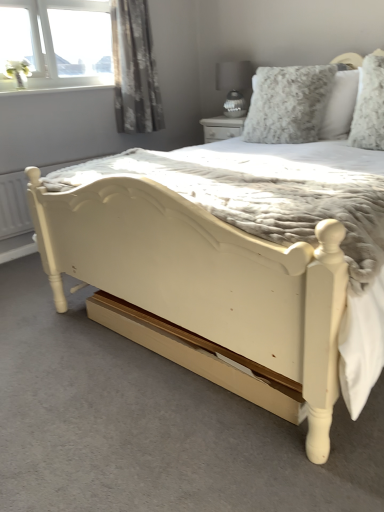
This screenshot has height=512, width=384. What do you see at coordinates (134, 69) in the screenshot?
I see `floral gray curtain at upper left` at bounding box center [134, 69].

Find the location of a particular element. This screenshot has height=512, width=384. fluffy gray pillow at upper right, which is counted as the 1th pillow, starting from the left is located at coordinates (299, 105).

Identify the location of fluffy white pillow at upper right, positioned as the first pillow in right-to-left order. (369, 106).

Where is `floral gray curtain at upper left`? This screenshot has height=512, width=384. floral gray curtain at upper left is located at coordinates (134, 69).

Between floral gray curtain at upper left and fluffy gray pillow at upper right, the second pillow from the right, which one has larger size?

With larger size is fluffy gray pillow at upper right, the second pillow from the right.

Are floral gray curtain at upper left and fluffy gray pillow at upper right, the second pillow from the right, beside each other?

There is a gap between floral gray curtain at upper left and fluffy gray pillow at upper right, the second pillow from the right.

Is floral gray curtain at upper left at the right side of fluffy gray pillow at upper right, the second pillow from the right?

Incorrect, floral gray curtain at upper left is not on the right side of fluffy gray pillow at upper right, the second pillow from the right.

Which is behind, point (244, 127) or point (147, 127)?

Positioned behind is point (147, 127).

Choose the correct answer: Is fluffy gray pillow at upper right, which is counted as the 1th pillow, starting from the left, inside floral gray curtain at upper left or outside it?

fluffy gray pillow at upper right, which is counted as the 1th pillow, starting from the left, lies outside floral gray curtain at upper left.

Considering the relative sizes of fluffy gray pillow at upper right, which is counted as the 1th pillow, starting from the left, and floral gray curtain at upper left in the image provided, is fluffy gray pillow at upper right, which is counted as the 1th pillow, starting from the left, shorter than floral gray curtain at upper left?

Indeed, fluffy gray pillow at upper right, which is counted as the 1th pillow, starting from the left, has a lesser height compared to floral gray curtain at upper left.

Which is behind, fluffy gray pillow at upper right, the second pillow from the right, or floral gray curtain at upper left?

floral gray curtain at upper left is more distant.

Is fluffy white pillow at upper right, positioned as the first pillow in right-to-left order, wider or thinner than fluffy gray pillow at upper right, the second pillow from the right?

Clearly, fluffy white pillow at upper right, positioned as the first pillow in right-to-left order, has less width compared to fluffy gray pillow at upper right, the second pillow from the right.

I want to click on pillow that appears below the fluffy gray pillow at upper right, which is counted as the 1th pillow, starting from the left (from the image's perspective), so click(x=369, y=106).

From the image's perspective, who appears lower, fluffy white pillow at upper right, positioned as the first pillow in right-to-left order, or fluffy gray pillow at upper right, the second pillow from the right?

From the image's view, fluffy white pillow at upper right, positioned as the first pillow in right-to-left order, is below.

What's the angular difference between fluffy gray pillow at upper right, the second pillow from the right, and matte gray glass lamp at upper center's facing directions?

They differ by 6.84 degrees in their facing directions.

From a real-world perspective, is fluffy gray pillow at upper right, the second pillow from the right, positioned under matte gray glass lamp at upper center based on gravity?

Yes, from a real-world perspective, fluffy gray pillow at upper right, the second pillow from the right, is under matte gray glass lamp at upper center.

Is fluffy gray pillow at upper right, which is counted as the 1th pillow, starting from the left, shorter than matte gray glass lamp at upper center?

Incorrect, the height of fluffy gray pillow at upper right, which is counted as the 1th pillow, starting from the left, does not fall short of that of matte gray glass lamp at upper center.

Which is less distant, (315,73) or (235,104)?

Point (315,73) is positioned closer to the camera compared to point (235,104).

Which object is positioned more to the left, fluffy white pillow at upper right, positioned as the first pillow in right-to-left order, or floral gray curtain at upper left?

Positioned to the left is floral gray curtain at upper left.

Considering the relative sizes of fluffy white pillow at upper right, positioned as the first pillow in right-to-left order, and floral gray curtain at upper left in the image provided, is fluffy white pillow at upper right, positioned as the first pillow in right-to-left order, thinner than floral gray curtain at upper left?

Yes.

From the image's perspective, does fluffy white pillow at upper right, placed as the second pillow when sorted from left to right, appear higher than floral gray curtain at upper left?

Actually, fluffy white pillow at upper right, placed as the second pillow when sorted from left to right, appears below floral gray curtain at upper left in the image.

Looking at this image, considering the relative sizes of fluffy white pillow at upper right, positioned as the first pillow in right-to-left order, and matte gray glass lamp at upper center in the image provided, is fluffy white pillow at upper right, positioned as the first pillow in right-to-left order, thinner than matte gray glass lamp at upper center?

Yes.

Visually, is fluffy white pillow at upper right, placed as the second pillow when sorted from left to right, positioned to the left or to the right of matte gray glass lamp at upper center?

fluffy white pillow at upper right, placed as the second pillow when sorted from left to right, is positioned on matte gray glass lamp at upper center's right side.

Is floral gray curtain at upper left inside or outside of matte gray glass lamp at upper center?

floral gray curtain at upper left is not inside matte gray glass lamp at upper center, it's outside.

Considering the relative positions of floral gray curtain at upper left and matte gray glass lamp at upper center in the image provided, is floral gray curtain at upper left behind matte gray glass lamp at upper center?

No, it is in front of matte gray glass lamp at upper center.

Can you tell me how much floral gray curtain at upper left and matte gray glass lamp at upper center differ in facing direction?

88.9 degrees separate the facing orientations of floral gray curtain at upper left and matte gray glass lamp at upper center.

Could you tell me if floral gray curtain at upper left is facing matte gray glass lamp at upper center?

No, floral gray curtain at upper left is not facing towards matte gray glass lamp at upper center.

The height and width of the screenshot is (512, 384). Find the location of `curtain that appears above the fluffy gray pillow at upper right, which is counted as the 1th pillow, starting from the left (from a real-world perspective)`. curtain that appears above the fluffy gray pillow at upper right, which is counted as the 1th pillow, starting from the left (from a real-world perspective) is located at coordinates (134, 69).

From a real-world perspective, count 1st pillows downward from the floral gray curtain at upper left and point to it. Please provide its 2D coordinates.

[(299, 105)]

Estimate the real-world distances between objects in this image. Which object is further from fluffy gray pillow at upper right, the second pillow from the right, fluffy white pillow at upper right, placed as the second pillow when sorted from left to right, or matte gray glass lamp at upper center?

matte gray glass lamp at upper center lies further to fluffy gray pillow at upper right, the second pillow from the right, than the other object.

In the scene shown: Which object lies nearer to the anchor point fluffy white pillow at upper right, placed as the second pillow when sorted from left to right, matte gray glass lamp at upper center or floral gray curtain at upper left?

matte gray glass lamp at upper center is positioned closer to the anchor fluffy white pillow at upper right, placed as the second pillow when sorted from left to right.

Which object lies nearer to the anchor point fluffy white pillow at upper right, placed as the second pillow when sorted from left to right, fluffy gray pillow at upper right, the second pillow from the right, or floral gray curtain at upper left?

fluffy gray pillow at upper right, the second pillow from the right, is closer to fluffy white pillow at upper right, placed as the second pillow when sorted from left to right.

From the image, which object appears to be nearer to floral gray curtain at upper left, fluffy white pillow at upper right, positioned as the first pillow in right-to-left order, or matte gray glass lamp at upper center?

matte gray glass lamp at upper center is closer to floral gray curtain at upper left.

Which object lies nearer to the anchor point matte gray glass lamp at upper center, fluffy white pillow at upper right, placed as the second pillow when sorted from left to right, or fluffy gray pillow at upper right, the second pillow from the right?

fluffy gray pillow at upper right, the second pillow from the right, is positioned closer to the anchor matte gray glass lamp at upper center.

When comparing their distances from fluffy gray pillow at upper right, which is counted as the 1th pillow, starting from the left, does floral gray curtain at upper left or matte gray glass lamp at upper center seem further?

floral gray curtain at upper left is further to fluffy gray pillow at upper right, which is counted as the 1th pillow, starting from the left.

Which object lies further to the anchor point matte gray glass lamp at upper center, fluffy white pillow at upper right, placed as the second pillow when sorted from left to right, or floral gray curtain at upper left?

Among the two, fluffy white pillow at upper right, placed as the second pillow when sorted from left to right, is located further to matte gray glass lamp at upper center.

Which object lies further to the anchor point matte gray glass lamp at upper center, fluffy gray pillow at upper right, which is counted as the 1th pillow, starting from the left, or fluffy white pillow at upper right, positioned as the first pillow in right-to-left order?

Among the two, fluffy white pillow at upper right, positioned as the first pillow in right-to-left order, is located further to matte gray glass lamp at upper center.

Identify the location of pillow positioned between fluffy white pillow at upper right, positioned as the first pillow in right-to-left order, and matte gray glass lamp at upper center from near to far. (299, 105).

Where is `lamp between floral gray curtain at upper left and fluffy gray pillow at upper right, the second pillow from the right, in the horizontal direction`? lamp between floral gray curtain at upper left and fluffy gray pillow at upper right, the second pillow from the right, in the horizontal direction is located at coordinates (234, 85).

Find the location of a particular element. pillow situated between floral gray curtain at upper left and fluffy white pillow at upper right, placed as the second pillow when sorted from left to right, from left to right is located at coordinates (299, 105).

This screenshot has width=384, height=512. Find the location of `lamp between floral gray curtain at upper left and fluffy white pillow at upper right, positioned as the first pillow in right-to-left order, in the horizontal direction`. lamp between floral gray curtain at upper left and fluffy white pillow at upper right, positioned as the first pillow in right-to-left order, in the horizontal direction is located at coordinates (234, 85).